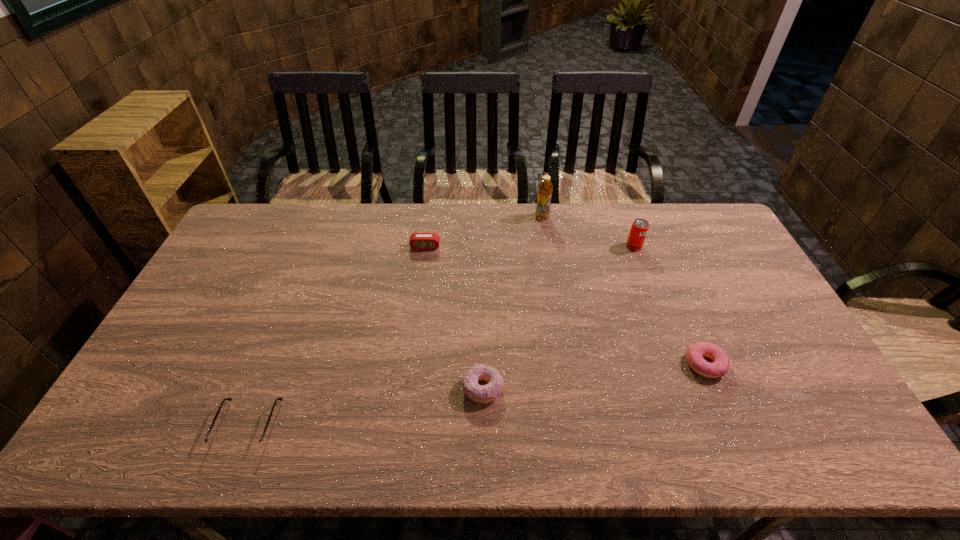
The image size is (960, 540). I want to click on free space located on the left of the left doughnut, so click(353, 389).

I want to click on free space located on the front-facing side of the fifth object from right to left, so click(x=421, y=273).

At what (x,y) coordinates should I click in order to perform the action: click on vacant space located 0.230m on the left of the right doughnut. Please return your answer as a coordinate pair (x, y). Looking at the image, I should click on (599, 364).

Find the location of `bottle situated at the far edge`. bottle situated at the far edge is located at coordinates (545, 187).

Image resolution: width=960 pixels, height=540 pixels. Find the location of `can at the far edge`. can at the far edge is located at coordinates click(x=639, y=228).

Locate an element on the screen. This screenshot has width=960, height=540. alarm clock situated at the far edge is located at coordinates (418, 241).

You are a GUI agent. You are given a task and a screenshot of the screen. Output one action in this format:
    pyautogui.click(x=<x>, y=<y>)
    Task: Click on the object that is at the near edge
    The width and height of the screenshot is (960, 540).
    Given the screenshot: What is the action you would take?
    pyautogui.click(x=215, y=444)

You are a GUI agent. You are given a task and a screenshot of the screen. Output one action in this format:
    pyautogui.click(x=<x>, y=<y>)
    Task: Click on the free region at the far edge of the desktop
    Image resolution: width=960 pixels, height=540 pixels.
    Given the screenshot: What is the action you would take?
    pyautogui.click(x=298, y=230)

This screenshot has width=960, height=540. I want to click on free space at the right edge, so click(x=773, y=343).

The width and height of the screenshot is (960, 540). I want to click on vacant space at the far right corner, so click(x=702, y=235).